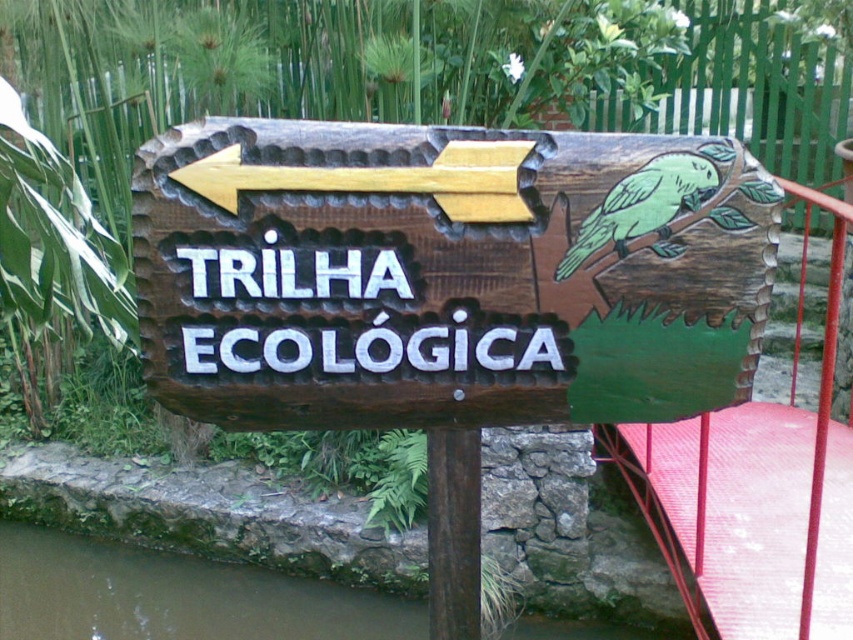
You are a maintenance worker needing to replace a loose bolt between the wooden at left and the brown wood pole at center. Given that your wrench has a 12 inch handle, can you comfortably reach the space between them to perform the repair?

The distance between the wooden at left and the brown wood pole at center is 17.74 inches. Since your wrench has a 12 inch handle, you have enough space to comfortably reach and perform the repair between them.

Based on the scene description, what object is located at the coordinates point (x=445, y=273)?

The wooden sign at center is located at point (x=445, y=273).